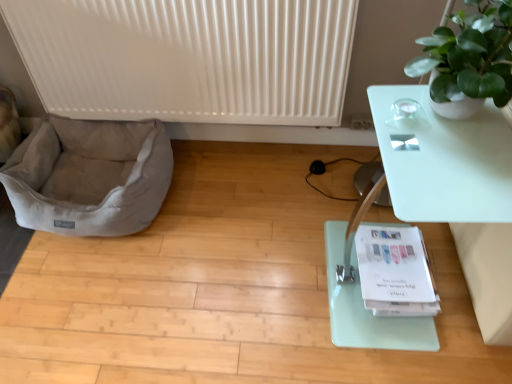
Question: Is white paper yoga mat at lower center inside or outside of white ribbed radiator at upper center?

Choices:
 (A) inside
 (B) outside

Answer: (B)

Question: Considering the positions of white paper yoga mat at lower center and white ribbed radiator at upper center in the image, is white paper yoga mat at lower center bigger or smaller than white ribbed radiator at upper center?

Choices:
 (A) big
 (B) small

Answer: (B)

Question: Considering the real-world distances, which object is farthest from the green matte plant at upper right?

Choices:
 (A) light gray fabric dog bed at lower left
 (B) transparent glass table at right
 (C) white paper yoga mat at lower center
 (D) white ribbed radiator at upper center

Answer: (A)

Question: Considering the real-world distances, which object is closest to the green matte plant at upper right?

Choices:
 (A) light gray fabric dog bed at lower left
 (B) white paper yoga mat at lower center
 (C) transparent glass table at right
 (D) white ribbed radiator at upper center

Answer: (C)